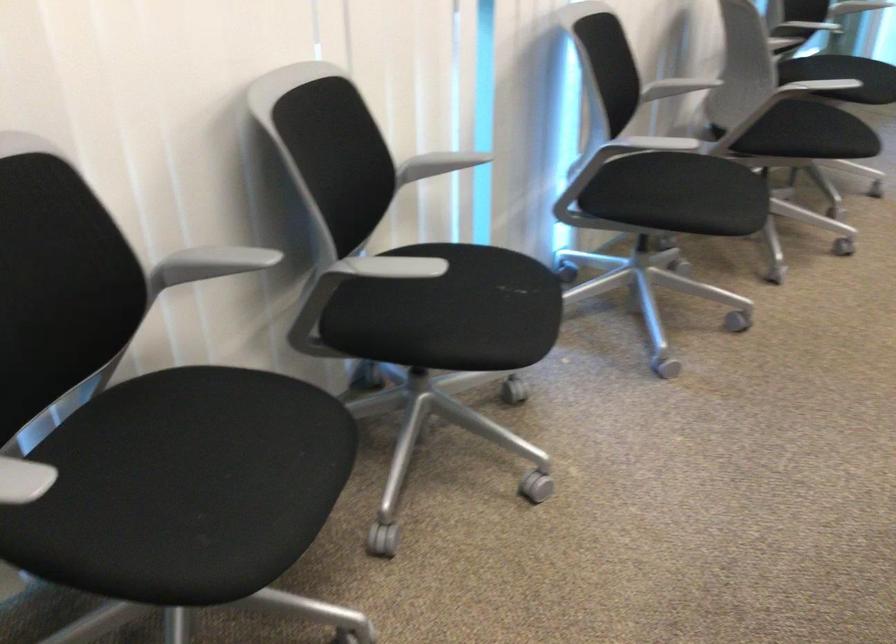
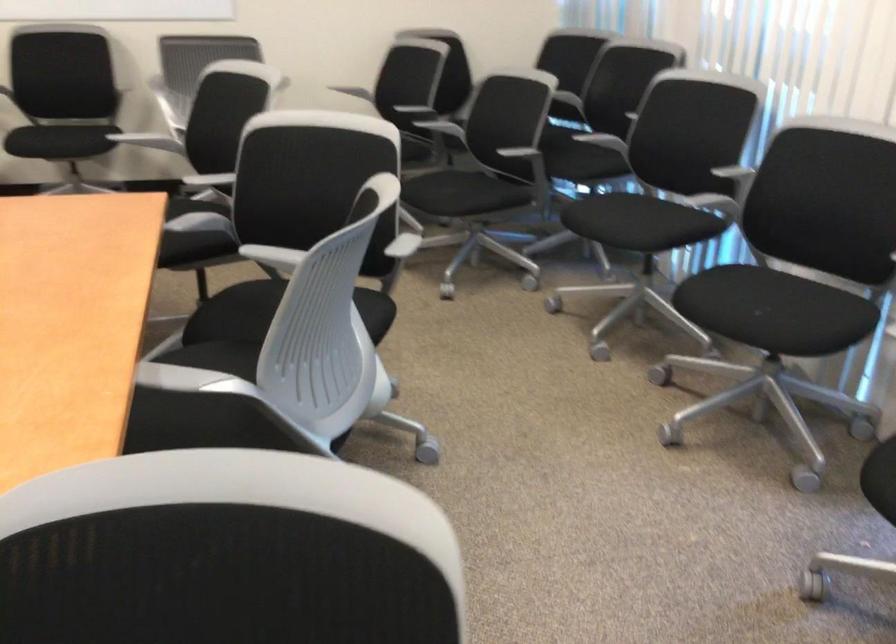
The point at [268,449] is marked in the first image. Where is the corresponding point in the second image?

(624, 221)